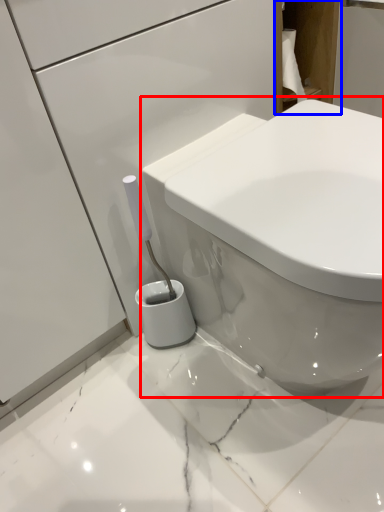
Question: Among these objects, which one is nearest to the camera, toilet (highlighted by a red box) or cabinetry (highlighted by a blue box)?

Choices:
 (A) toilet
 (B) cabinetry

Answer: (A)